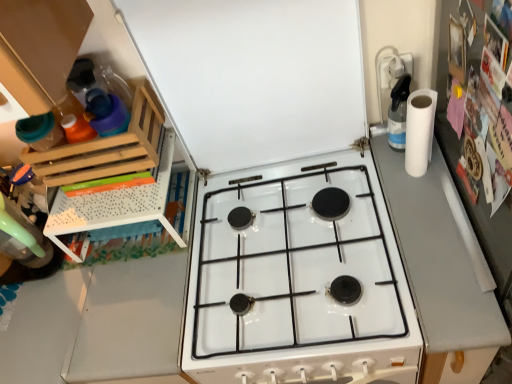
Identify the location of free space to the left of white matte exhaust hood at upper center. This screenshot has width=512, height=384. (238, 203).